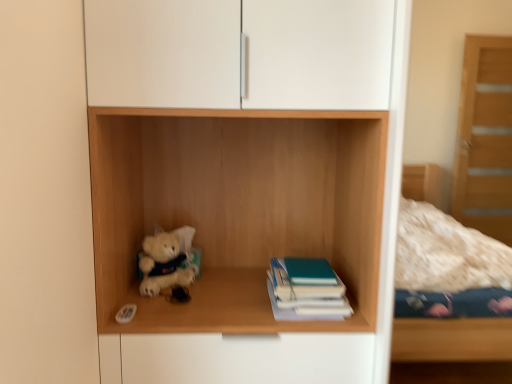
Question: Could fluffy white teddy bear at lower left be considered to be inside wooden shelf at center?

Choices:
 (A) yes
 (B) no

Answer: (A)

Question: Considering the relative sizes of wooden shelf at center and fluffy white teddy bear at lower left in the image provided, is wooden shelf at center shorter than fluffy white teddy bear at lower left?

Choices:
 (A) no
 (B) yes

Answer: (A)

Question: Is wooden shelf at center closer to camera compared to fluffy white teddy bear at lower left?

Choices:
 (A) no
 (B) yes

Answer: (B)

Question: Does wooden shelf at center appear on the right side of fluffy white teddy bear at lower left?

Choices:
 (A) no
 (B) yes

Answer: (B)

Question: Is wooden shelf at center positioned beyond the bounds of fluffy white teddy bear at lower left?

Choices:
 (A) yes
 (B) no

Answer: (A)

Question: From a real-world perspective, is wooden shelf at center positioned over fluffy white teddy bear at lower left based on gravity?

Choices:
 (A) yes
 (B) no

Answer: (A)

Question: From the image's perspective, does teal matte book at center appear lower than fluffy white teddy bear at lower left?

Choices:
 (A) yes
 (B) no

Answer: (A)

Question: Can you confirm if teal matte book at center is bigger than fluffy white teddy bear at lower left?

Choices:
 (A) no
 (B) yes

Answer: (B)

Question: Is fluffy white teddy bear at lower left inside teal matte book at center?

Choices:
 (A) no
 (B) yes

Answer: (A)

Question: Is teal matte book at center turned away from fluffy white teddy bear at lower left?

Choices:
 (A) yes
 (B) no

Answer: (B)

Question: Considering the relative sizes of teal matte book at center and fluffy white teddy bear at lower left in the image provided, is teal matte book at center wider than fluffy white teddy bear at lower left?

Choices:
 (A) no
 (B) yes

Answer: (B)

Question: Are teal matte book at center and fluffy white teddy bear at lower left located far from each other?

Choices:
 (A) no
 (B) yes

Answer: (A)

Question: From the image's perspective, is teal matte book at center beneath wooden shelf at center?

Choices:
 (A) yes
 (B) no

Answer: (A)